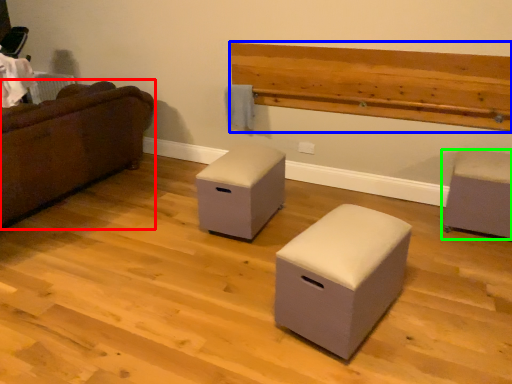
Question: Estimate the real-world distances between objects in this image. Which object is closer to studio couch (highlighted by a red box), hardwood (highlighted by a blue box) or furniture (highlighted by a green box)?

Choices:
 (A) hardwood
 (B) furniture

Answer: (A)